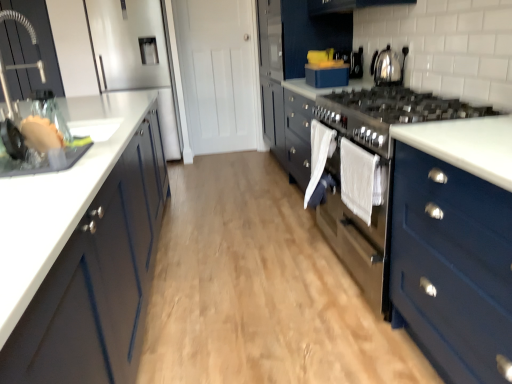
The width and height of the screenshot is (512, 384). Identify the location of vacant space positioned to the left of shiny metallic kettle at upper right. (354, 83).